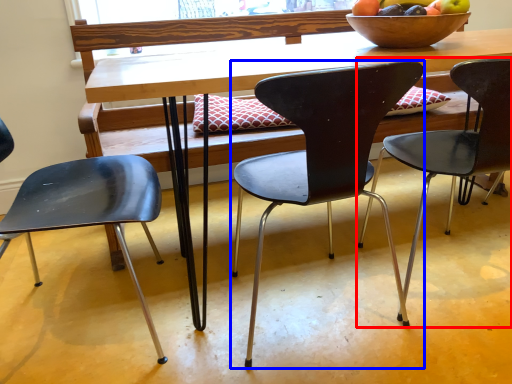
Question: Which object is closer to the camera taking this photo, chair (highlighted by a red box) or chair (highlighted by a blue box)?

Choices:
 (A) chair
 (B) chair

Answer: (B)